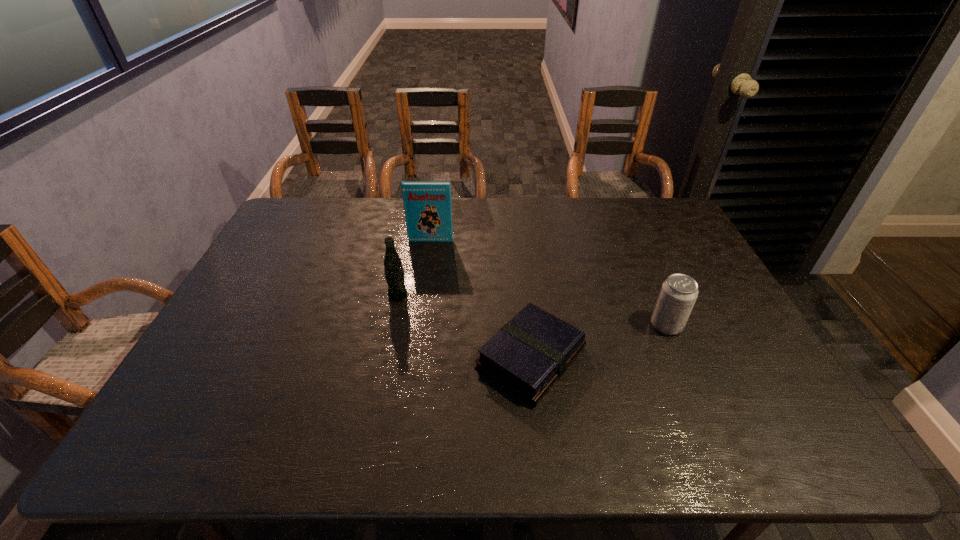
Identify the location of free space located 0.290m on the left of the right book. (359, 358).

In the image, there is a desktop. Where is `free space at the far edge`? free space at the far edge is located at coordinates (464, 231).

The height and width of the screenshot is (540, 960). In the image, there is a desktop. In order to click on free space at the right edge in this screenshot , I will do `click(738, 314)`.

This screenshot has width=960, height=540. Identify the location of free space at the far right corner of the desktop. (668, 205).

Find the location of a particular element. This screenshot has width=960, height=540. vacant space at the near right corner of the desktop is located at coordinates (780, 456).

In order to click on free space that is in between the shortest object and the second shortest object in this screenshot , I will do `click(599, 341)`.

This screenshot has height=540, width=960. In order to click on free spot between the shortest object and the soda can in this screenshot , I will do `click(599, 341)`.

This screenshot has height=540, width=960. Find the location of `blank region between the beer bottle and the farthest object`. blank region between the beer bottle and the farthest object is located at coordinates (415, 268).

Locate an element on the screen. This screenshot has height=540, width=960. vacant area that lies between the beer bottle and the second object from right to left is located at coordinates (465, 327).

I want to click on vacant space that's between the farthest object and the soda can, so click(548, 282).